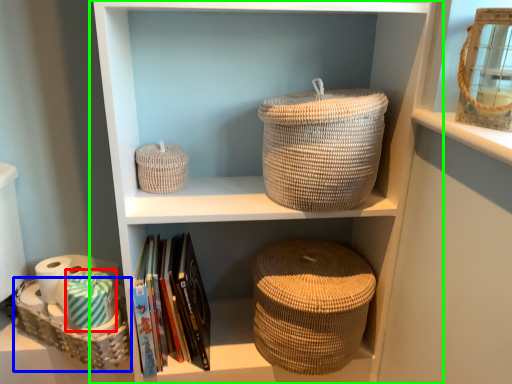
Question: Based on their relative distances, which object is farther from toilet paper (highlighted by a red box)? Choose from basket (highlighted by a blue box) and shelf (highlighted by a green box).

Choices:
 (A) basket
 (B) shelf

Answer: (B)